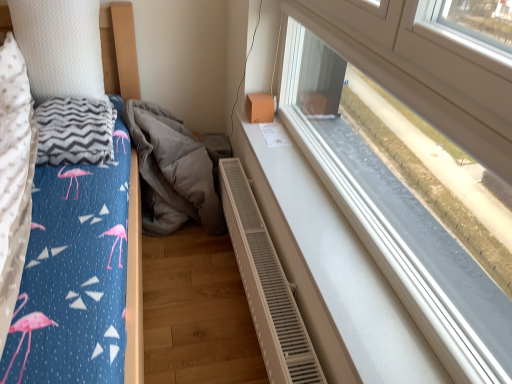
Where is `free space underneath white plastic window at upper right (from a real-world perspective)`? This screenshot has height=384, width=512. free space underneath white plastic window at upper right (from a real-world perspective) is located at coordinates (331, 212).